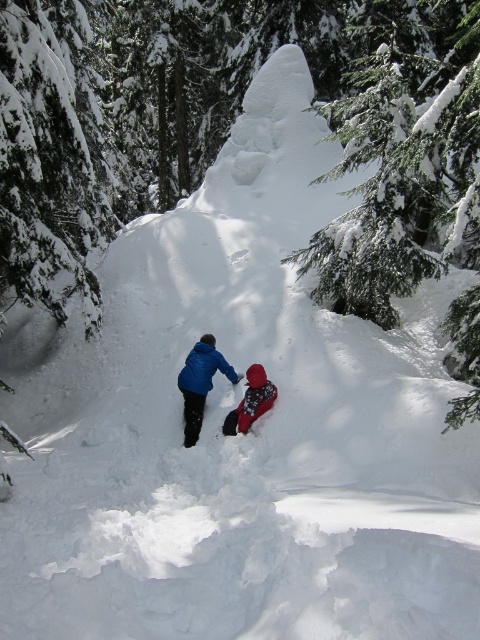
You are planning to take a photo of both the blue fabric jacket at center and the red fleece jacket at center in the snowy forest. Which jacket should you focus on first to ensure both are in the frame?

You should focus on the blue fabric jacket at center first because it is closer to you than the red fleece jacket at center, ensuring both are in the frame.

You are planning to take a photo of both the blue fabric jacket at center and the red fleece jacket at center in the snowy forest scene. Which jacket should you focus on first if you want to capture the wider one in your frame?

The blue fabric jacket at center is wider than the red fleece jacket at center, so you should focus on the blue fabric jacket at center first to capture the wider one in your frame.

You are planning to take a group photo of the two people in the snowy forest. The photographer wants the blue fabric jacket at center and the red fleece jacket at center to be clearly visible. Which jacket should be placed closer to the camera to ensure both are visible without one blocking the other?

The blue fabric jacket at center is bigger than the red fleece jacket at center, so placing the smaller red fleece jacket at center closer to the camera would allow both jackets to be visible without the larger one blocking the smaller one.